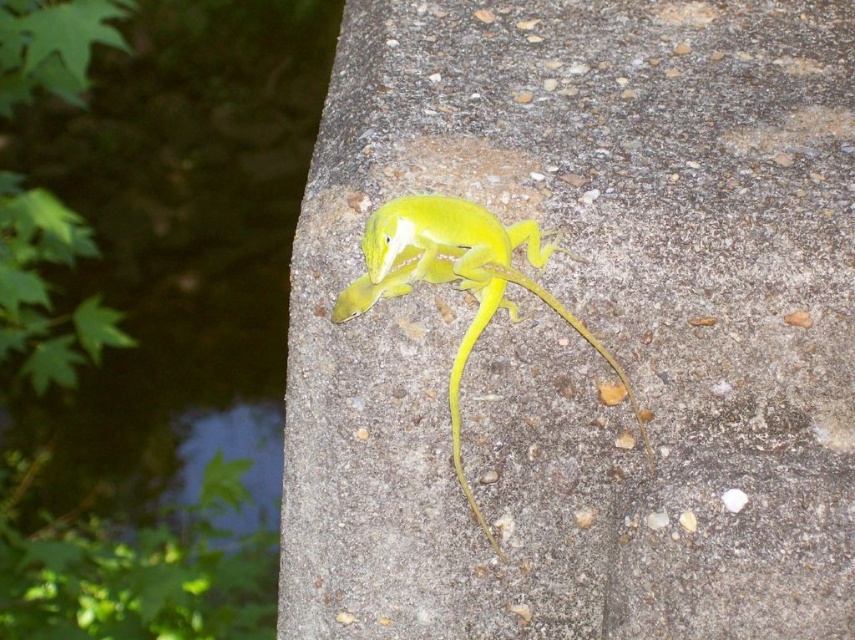
Question: Which object appears farthest from the camera in this image?

Choices:
 (A) smooth concrete at center
 (B) green matte lizard at center

Answer: (A)

Question: Among these objects, which one is farthest from the camera?

Choices:
 (A) smooth concrete at center
 (B) green matte lizard at center

Answer: (A)

Question: Does smooth concrete at center lie in front of green matte lizard at center?

Choices:
 (A) no
 (B) yes

Answer: (A)

Question: Is smooth concrete at center thinner than green matte lizard at center?

Choices:
 (A) yes
 (B) no

Answer: (B)

Question: Can you confirm if smooth concrete at center is positioned to the right of green matte lizard at center?

Choices:
 (A) no
 (B) yes

Answer: (B)

Question: Which of the following is the closest to the observer?

Choices:
 (A) (516, 241)
 (B) (741, 138)

Answer: (A)